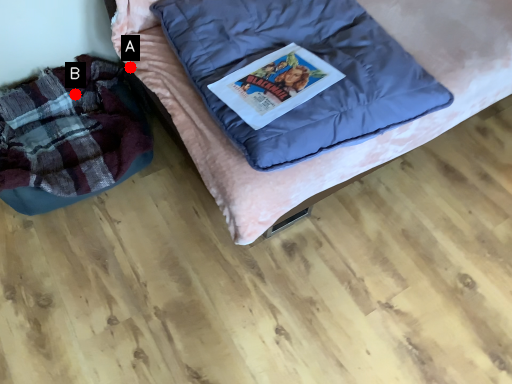
Question: Two points are circled on the image, labeled by A and B beside each circle. Which point is further to the camera?

Choices:
 (A) A is further
 (B) B is further

Answer: (B)